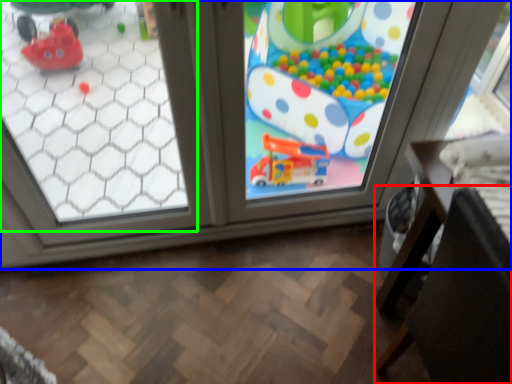
Question: Considering the real-world distances, which object is closest to chair (highlighted by a red box)? window (highlighted by a blue box) or window (highlighted by a green box).

Choices:
 (A) window
 (B) window

Answer: (A)